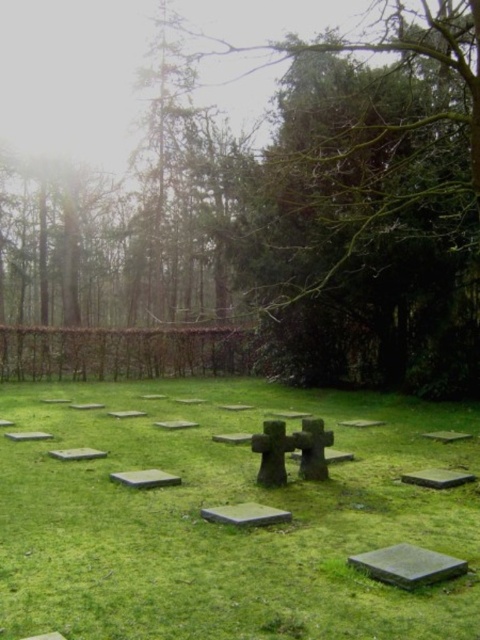
Question: Can you confirm if gray concrete gravestone at center is thinner than gray concrete stone at lower left?

Choices:
 (A) yes
 (B) no

Answer: (A)

Question: Which of the following is the farthest from the observer?

Choices:
 (A) (240, 504)
 (B) (38, 440)

Answer: (B)

Question: Among these points, which one is nearest to the camera?

Choices:
 (A) (224, 436)
 (B) (24, 433)
 (C) (229, 508)

Answer: (C)

Question: Which point is farther to the camera?

Choices:
 (A) (424, 477)
 (B) (134, 342)
 (C) (259, 516)
 (D) (80, 452)

Answer: (B)

Question: Can you confirm if black stone gravestone at lower right is thinner than gray concrete cross at center?

Choices:
 (A) yes
 (B) no

Answer: (B)

Question: Where is smooth gray stone at lower right located in relation to gray concrete cross at center in the image?

Choices:
 (A) above
 (B) below

Answer: (A)